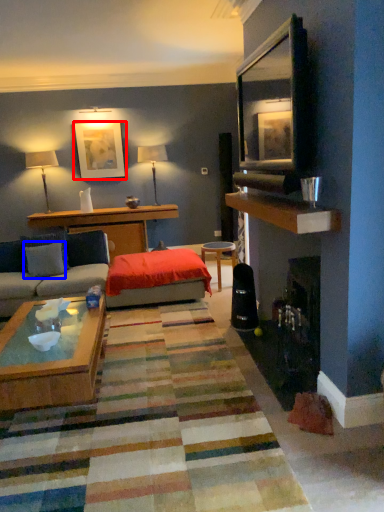
Question: Which of the following is the closest to the observer, picture frame (highlighted by a red box) or pillow (highlighted by a blue box)?

Choices:
 (A) picture frame
 (B) pillow

Answer: (B)